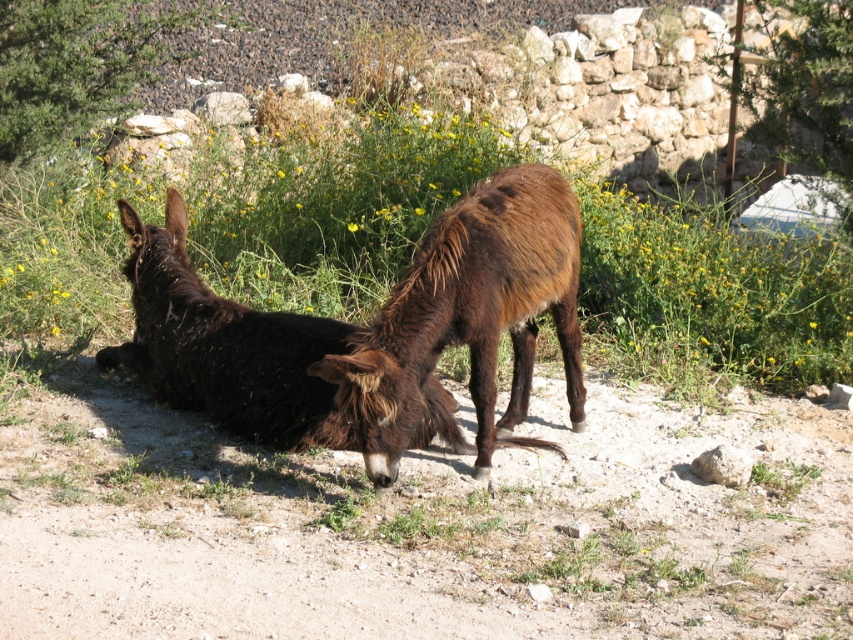
You are a photographer trying to capture the brown fuzzy donkey at center. You know that the camera you are using has a focal point at point (468, 316). Will the brown fuzzy donkey at center be in focus?

The brown fuzzy donkey at center is located at point (468, 316), so yes, the camera will focus on it since the focal point is exactly at that coordinate.

You are standing in the field where the two donkeys are located. You want to reach a specific point marked at coordinates point (532,189). If you can walk 20 feet in a straight line from your current position, will you be able to reach that point?

The distance of point (532,189) from viewer is 18.32 feet, so yes, you can reach it since it is within the 20 feet range.